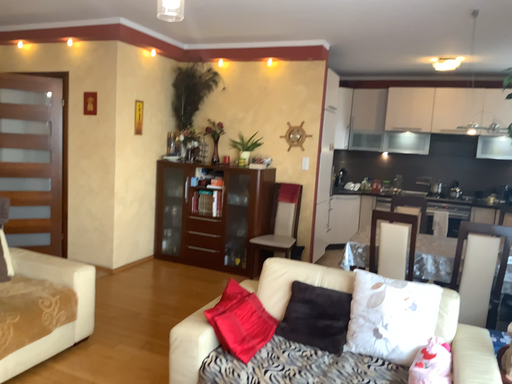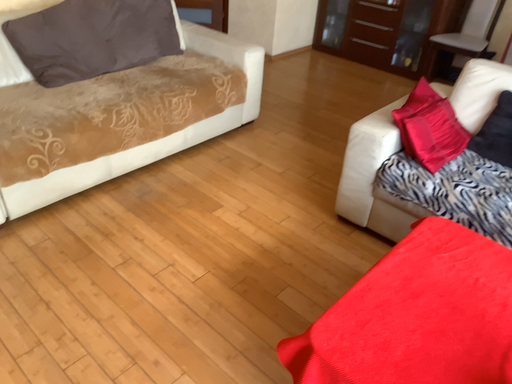
Question: Which way did the camera rotate in the video?

Choices:
 (A) rotated upward
 (B) rotated downward

Answer: (B)